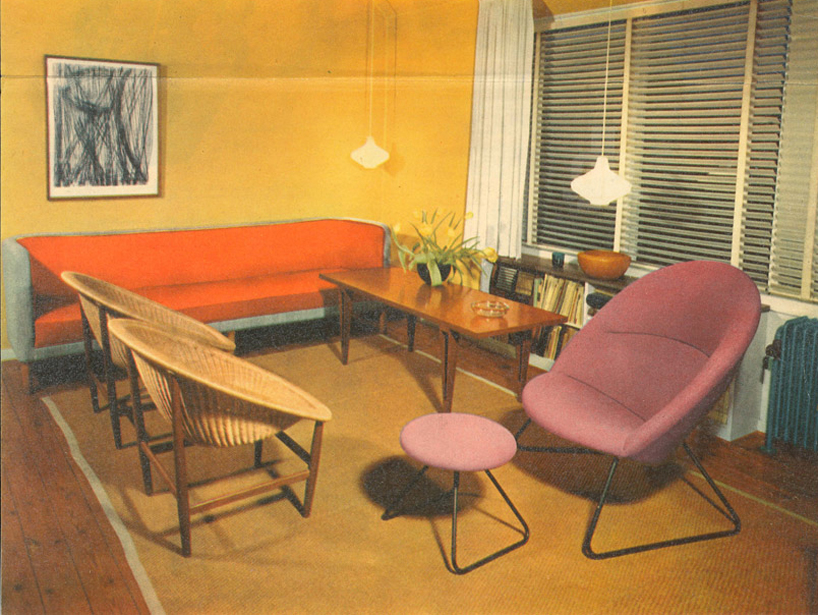
I want to click on chairs, so click(676, 344), click(187, 402), click(106, 323).